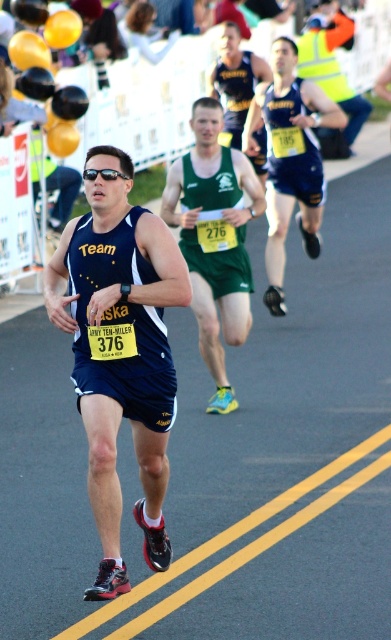
Question: Can you confirm if green fabric running suit at center is thinner than yellow reflective vest at upper right?

Choices:
 (A) yes
 (B) no

Answer: (A)

Question: Is green fabric running suit at center above blue athletic shorts at center?

Choices:
 (A) no
 (B) yes

Answer: (A)

Question: Can you confirm if matte blue singlet at center is smaller than yellow reflective vest at upper right?

Choices:
 (A) yes
 (B) no

Answer: (A)

Question: Among these objects, which one is nearest to the camera?

Choices:
 (A) green fabric running suit at center
 (B) blue athletic shorts at center
 (C) matte blue singlet at center

Answer: (C)

Question: Which object appears closest to the camera in this image?

Choices:
 (A) green fabric running suit at center
 (B) matte blue singlet at center
 (C) yellow reflective vest at upper right
 (D) blue athletic shorts at center

Answer: (B)

Question: Which of the following is the closest to the observer?

Choices:
 (A) matte blue singlet at center
 (B) green fabric running suit at center
 (C) blue athletic shorts at center
 (D) yellow reflective vest at upper right

Answer: (A)